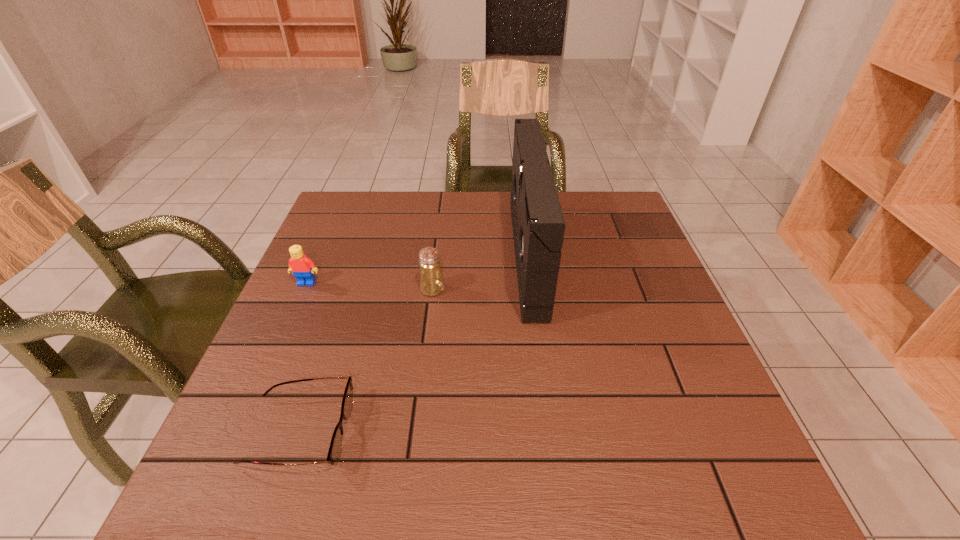
The width and height of the screenshot is (960, 540). What are the coordinates of `the rightmost object` in the screenshot? It's located at (538, 225).

Locate an element on the screen. This screenshot has width=960, height=540. the tallest object is located at coordinates (538, 225).

This screenshot has height=540, width=960. What are the coordinates of `the second object from right to left` in the screenshot? It's located at (431, 280).

Locate an element on the screen. This screenshot has height=540, width=960. Lego is located at coordinates (302, 267).

Identify the location of spectacles. (335, 448).

Find the location of a particular element. Image resolution: width=960 pixels, height=540 pixels. the nearest object is located at coordinates (335, 448).

The height and width of the screenshot is (540, 960). Find the location of `blank space located on the side of the videotape with visible spindles`. blank space located on the side of the videotape with visible spindles is located at coordinates (473, 256).

Identify the location of vacant space located 0.200m on the side of the videotape with visible spindles. The height and width of the screenshot is (540, 960). 440,256.

I want to click on free region located on the side of the videotape with visible spindles, so click(401, 256).

This screenshot has height=540, width=960. I want to click on free location located 0.310m on the back of the saltshaker, so click(442, 213).